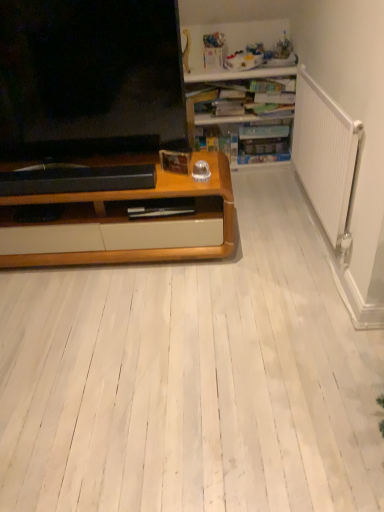
The image size is (384, 512). Find the location of `free space in front of wooden desk at upper right`. free space in front of wooden desk at upper right is located at coordinates (249, 183).